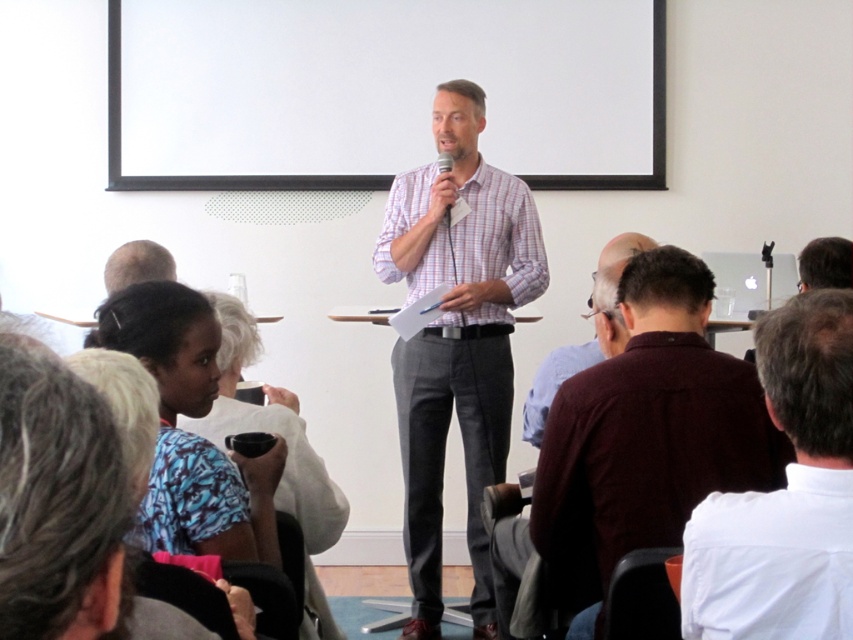
Question: Can you confirm if plaid cotton shirt at center is positioned below white shirt at lower right?

Choices:
 (A) no
 (B) yes

Answer: (A)

Question: Can you confirm if blue patterned shirt at lower left is thinner than maroon sweater at center?

Choices:
 (A) yes
 (B) no

Answer: (A)

Question: Which object is the farthest from the white shirt at lower right?

Choices:
 (A) blue patterned shirt at lower left
 (B) light brown hair at upper left
 (C) dark maroon shirt at center

Answer: (B)

Question: Which point is farther to the camera?

Choices:
 (A) (437, 148)
 (B) (143, 243)

Answer: (A)

Question: Observing the image, what is the correct spatial positioning of blue patterned shirt at lower left in reference to maroon sweater at center?

Choices:
 (A) below
 (B) above

Answer: (A)

Question: Among these points, which one is farthest from the camera?

Choices:
 (A) (134, 278)
 (B) (786, 636)

Answer: (A)